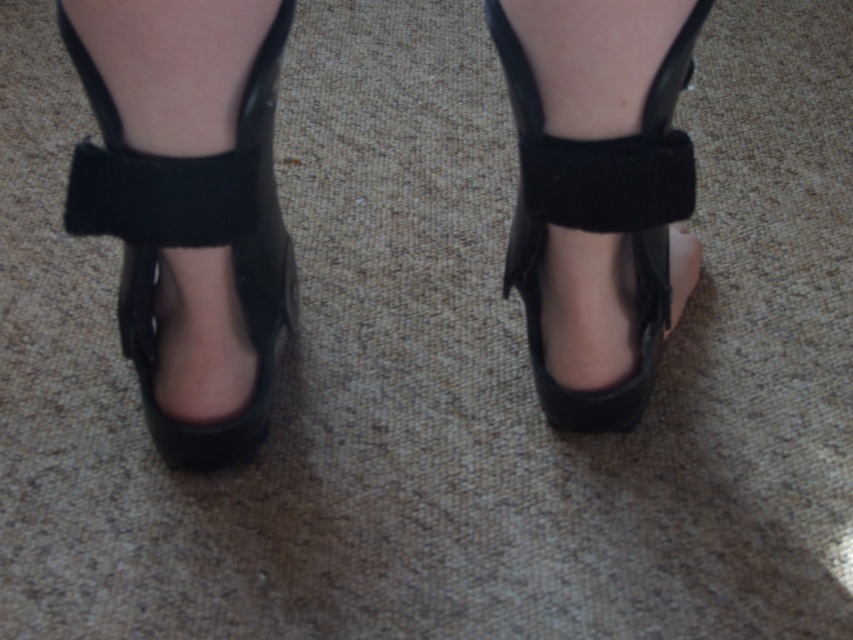
Can you confirm if shiny black platform shoes at center is positioned to the right of black leather shoe at center?

Yes, shiny black platform shoes at center is to the right of black leather shoe at center.

The height and width of the screenshot is (640, 853). What do you see at coordinates (189, 209) in the screenshot?
I see `shiny black platform shoes at center` at bounding box center [189, 209].

Locate an element on the screen. The image size is (853, 640). shiny black platform shoes at center is located at coordinates (189, 209).

Who is positioned more to the right, black leather shoe at center or black suede shoe at center?

From the viewer's perspective, black suede shoe at center appears more on the right side.

From the picture: Can you confirm if black leather shoe at center is taller than black suede shoe at center?

Indeed, black leather shoe at center has a greater height compared to black suede shoe at center.

Between point (231, 218) and point (532, 225), which one is positioned behind?

The point (532, 225) is more distant.

This screenshot has width=853, height=640. I want to click on black leather shoe at center, so click(190, 241).

Between point (100, 113) and point (508, 294), which one is positioned behind?

The point (508, 294) is behind.

Between point (598, 125) and point (535, 300), which one is positioned in front?

Point (598, 125)

Locate an element on the screen. This screenshot has width=853, height=640. shiny black platform shoes at center is located at coordinates (189, 209).